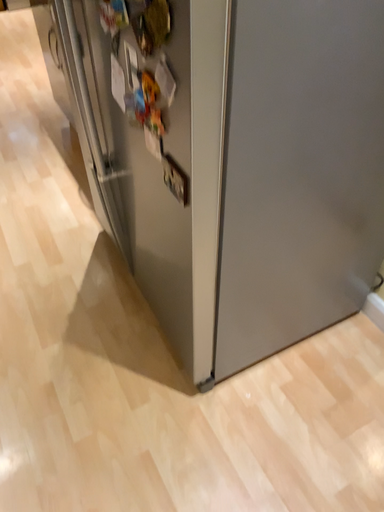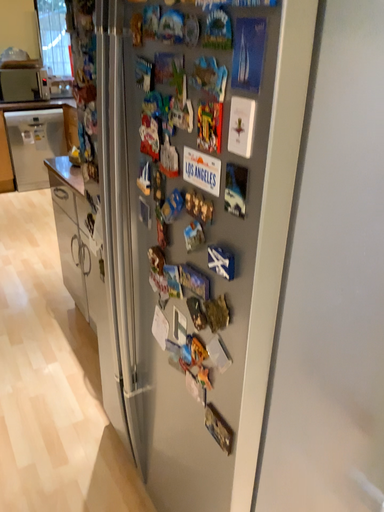
Question: Which way did the camera rotate in the video?

Choices:
 (A) rotated downward
 (B) rotated upward

Answer: (B)